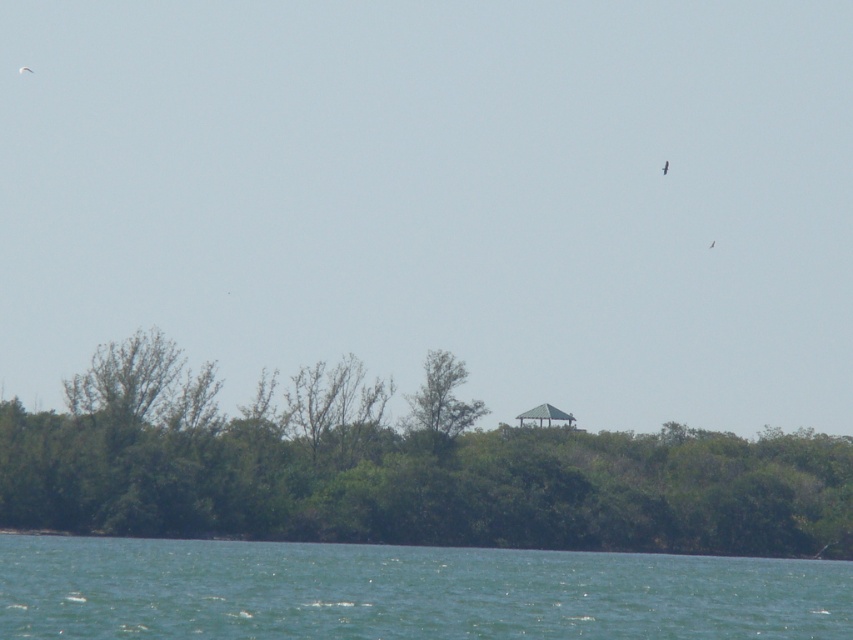
You are standing at the center of the image and want to walk towards the green leafy trees at center. Which direction should you face to head directly towards them?

Since the green leafy trees at center are located at point (398,470), you should face slightly to the right and forward to head directly towards them.

You are a bird flying over the landscape and want to land on the highest point between the green leafy trees at center and the green water at lower center. Which one should you choose?

The green leafy trees at center are much taller than the green water at lower center, so you should choose the green leafy trees at center to land on the highest point.